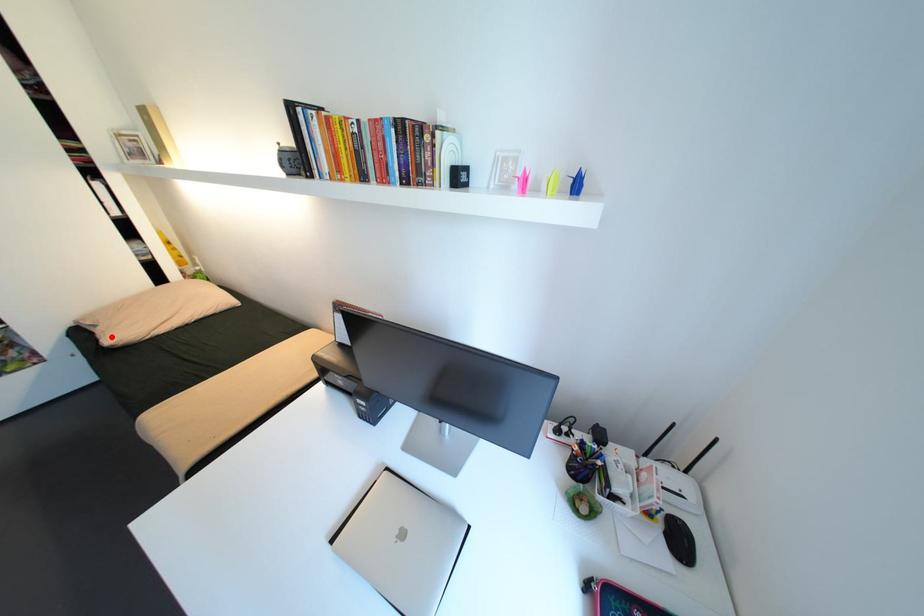
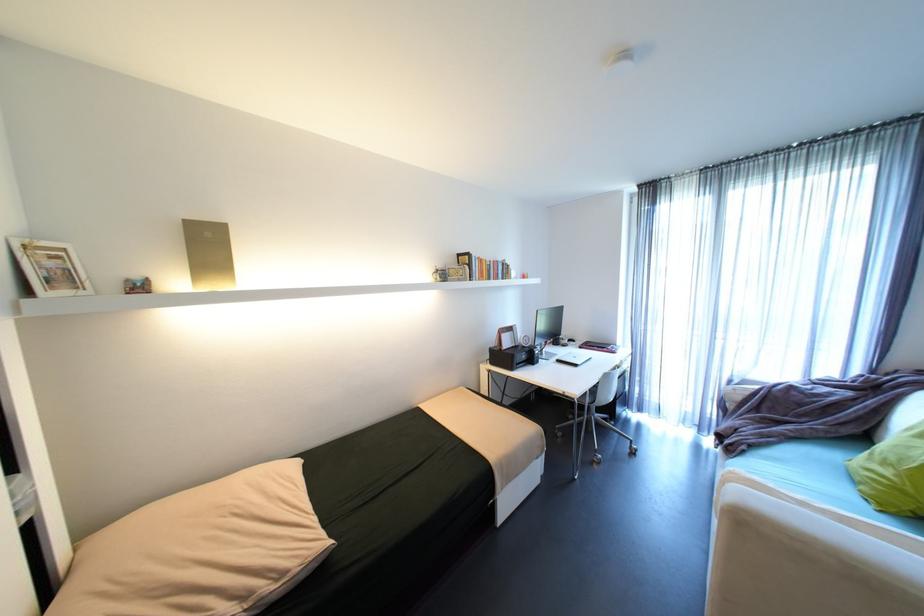
In the second image, find the point that corresponds to the highlighted location in the first image.

(289, 575)